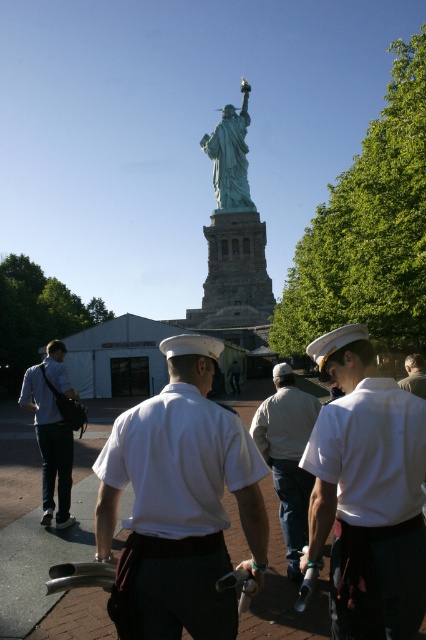
Question: Which point is closer to the camera?

Choices:
 (A) green patina statue at center
 (B) white uniform shirt at center
 (C) light gray cotton jacket at center
 (D) matte white uniform at center

Answer: (B)

Question: Where is light gray cotton jacket at center located in relation to brown leather jacket at center in the image?

Choices:
 (A) below
 (B) above

Answer: (A)

Question: Which point appears farthest from the camera in this image?

Choices:
 (A) (68, 426)
 (B) (389, 516)
 (C) (425, 378)

Answer: (C)

Question: Where is matte white uniform at center located in relation to brown leather jacket at center in the image?

Choices:
 (A) above
 (B) below

Answer: (B)

Question: Is matte white uniform at center positioned in front of brown leather jacket at center?

Choices:
 (A) no
 (B) yes

Answer: (B)

Question: Based on their relative distances, which object is nearer to the brown leather jacket at center?

Choices:
 (A) white uniform shirt at center
 (B) white matte uniform at center
 (C) matte white uniform at center

Answer: (B)